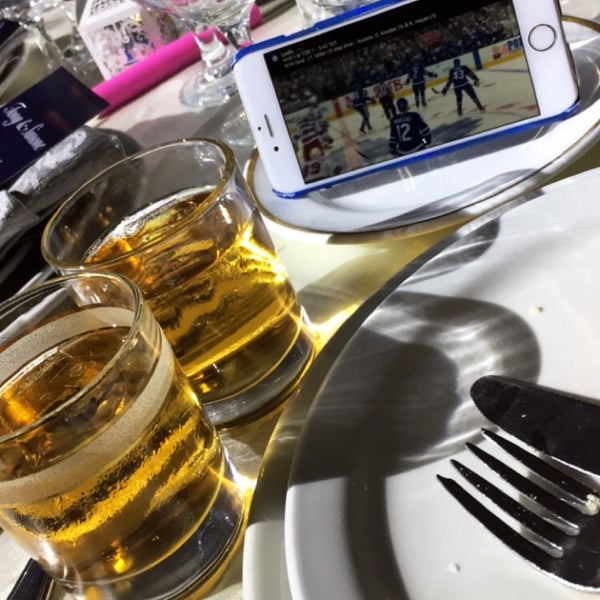
This screenshot has width=600, height=600. I want to click on plate, so click(386, 499).